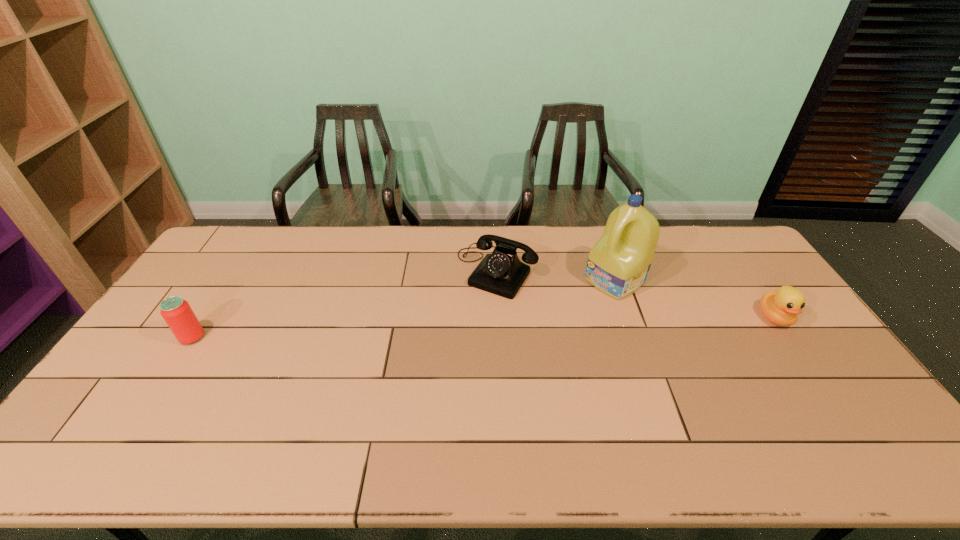
At what (x,y) coordinates should I click in order to perform the action: click on empty space that is in between the beer can and the second object from left to right. Please return your answer as a coordinate pair (x, y). This screenshot has height=540, width=960. Looking at the image, I should click on (345, 305).

Image resolution: width=960 pixels, height=540 pixels. Identify the location of vacant space in between the telephone and the tallest object. (556, 276).

Where is `the second closest object to the duckling`? The image size is (960, 540). the second closest object to the duckling is located at coordinates (502, 273).

This screenshot has height=540, width=960. I want to click on the second closest object to the tallest object, so click(x=781, y=307).

I want to click on free space that satisfies the following two spatial constraints: 1. on the front side of the telephone; 2. on the left side of the third object from left to right, so click(496, 280).

Find the location of `free space that satisfies the following two spatial constraints: 1. on the front side of the telephone; 2. on the right side of the detergent`. free space that satisfies the following two spatial constraints: 1. on the front side of the telephone; 2. on the right side of the detergent is located at coordinates (496, 280).